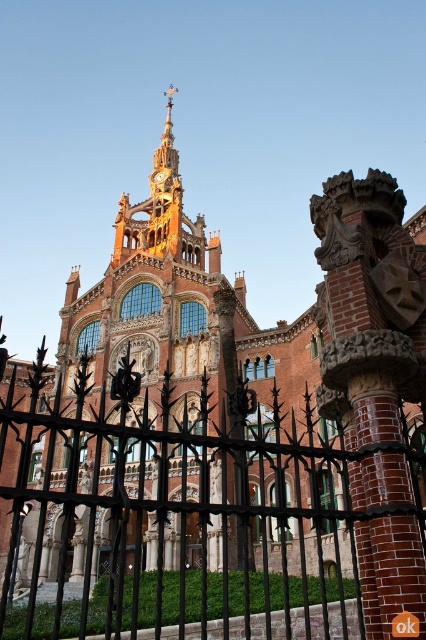
You are a painter standing at the front of the building and want to paint both the black wrought iron fence at center and the gold metallic clock at center. Which object should you focus on first if you want to paint the wider one first?

The black wrought iron fence at center might be wider than gold metallic clock at center, so you should focus on painting the black wrought iron fence at center first.

You are standing in front of the grand ornate building and want to take a photo of the gold metallic clock at center without any obstructions. Is the black wrought iron fence at center blocking your view of the clock?

The black wrought iron fence at center is in front of the gold metallic clock at center, so it would block your view of the clock. You need to move to a position where the fence is not between you and the clock.